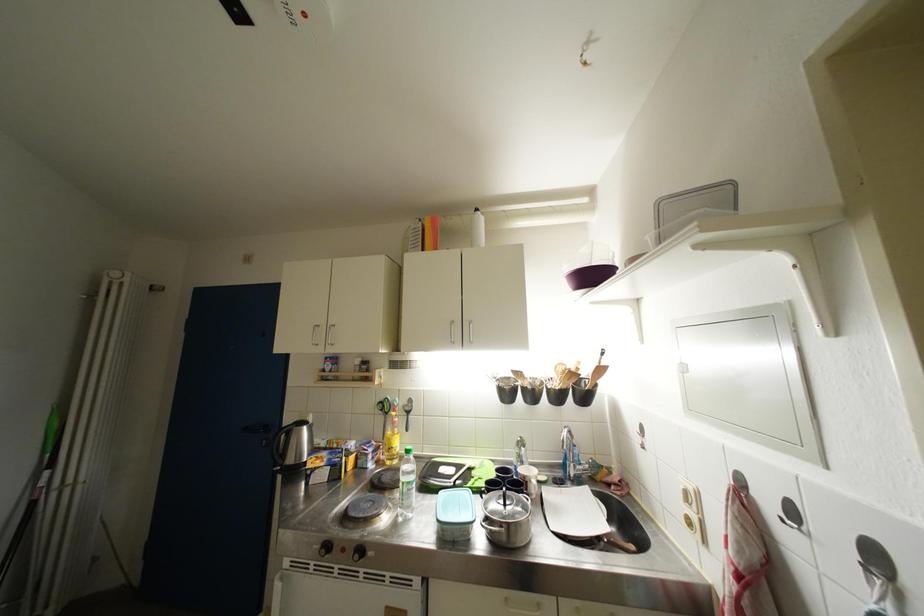
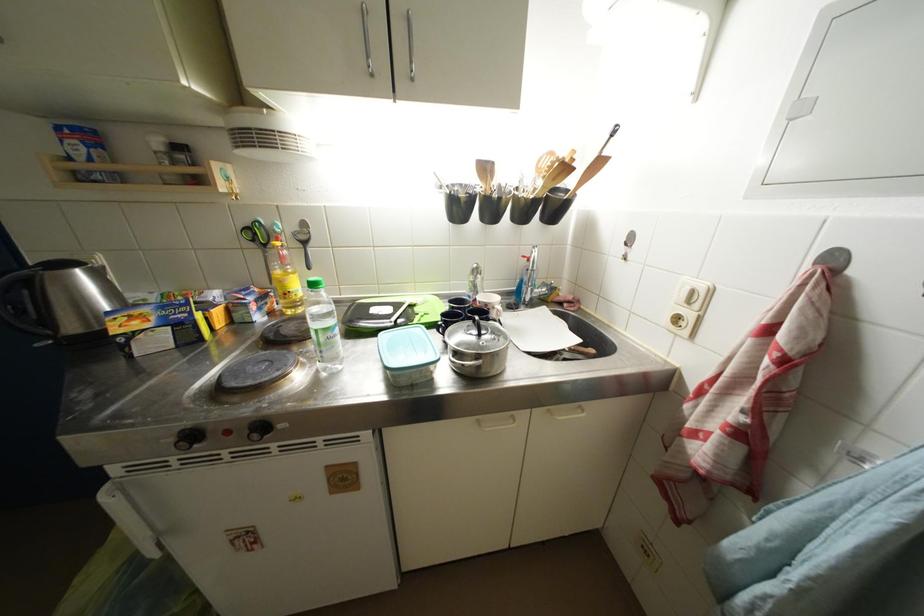
The point at [388,403] is marked in the first image. Where is the corresponding point in the second image?

(253, 227)